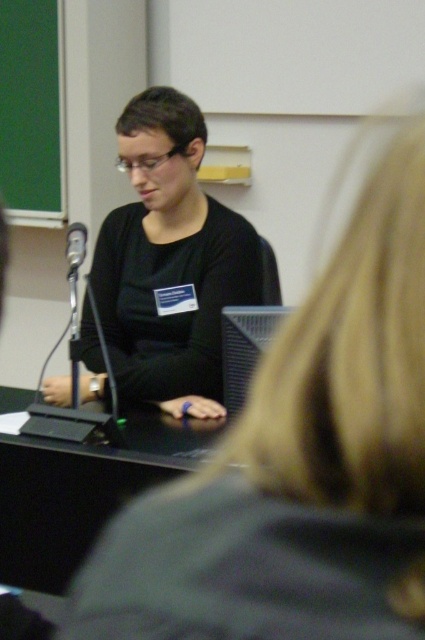
You are a student in the classroom and need to write something on the green chalkboard at upper left and the black plastic microphone at left. Which object will require you to move closer to the front of the room to reach it?

The black plastic microphone at left is smaller than the green chalkboard at upper left, so you would need to move closer to the front of the room to reach it.

You are a stagehand setting up for a presentation. The presenter needs to adjust the distance between the green chalkboard at upper left and the black plastic microphone at left to exactly 1.5 meters. Currently, they are 1.61 meters apart. Which object should you move closer to achieve the desired distance?

To reduce the distance between the green chalkboard at upper left and the black plastic microphone at left from 1.61 meters to 1.5 meters, you should move one of the objects closer to the other. Since both objects are part of the setup, moving either the green chalkboard at upper left or the black plastic microphone at left toward each other by 0.11 meters would achieve the required distance.